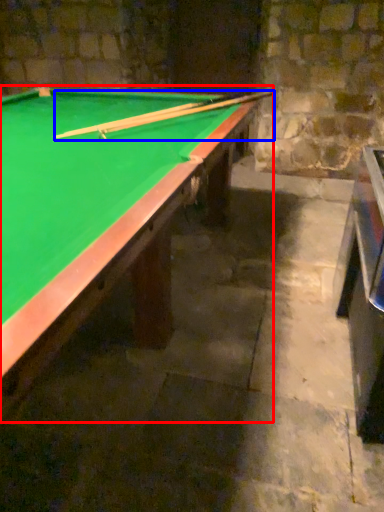
Question: Which object appears farthest to the camera in this image, billiard table (highlighted by a red box) or cue (highlighted by a blue box)?

Choices:
 (A) billiard table
 (B) cue

Answer: (B)